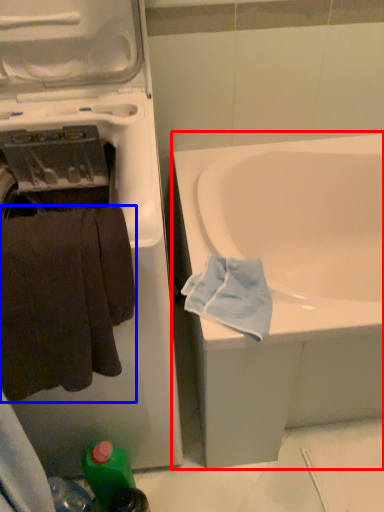
Question: Which point is further to the camera, bathtub (highlighted by a red box) or towel (highlighted by a blue box)?

Choices:
 (A) bathtub
 (B) towel

Answer: (A)